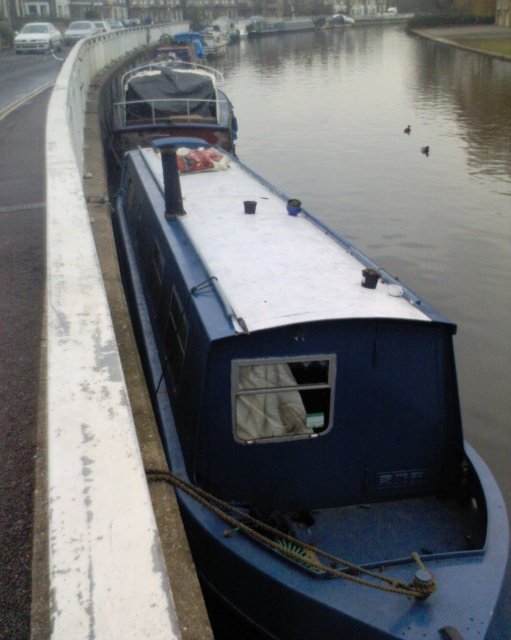
Question: Among these objects, which one is nearest to the camera?

Choices:
 (A) blue matte barge at center
 (B) blue matte boat at center

Answer: (A)

Question: Is blue matte barge at center to the left of blue matte boat at center from the viewer's perspective?

Choices:
 (A) yes
 (B) no

Answer: (B)

Question: Does blue matte barge at center appear on the right side of blue matte boat at center?

Choices:
 (A) yes
 (B) no

Answer: (A)

Question: Is blue matte barge at center to the right of blue matte boat at center from the viewer's perspective?

Choices:
 (A) no
 (B) yes

Answer: (B)